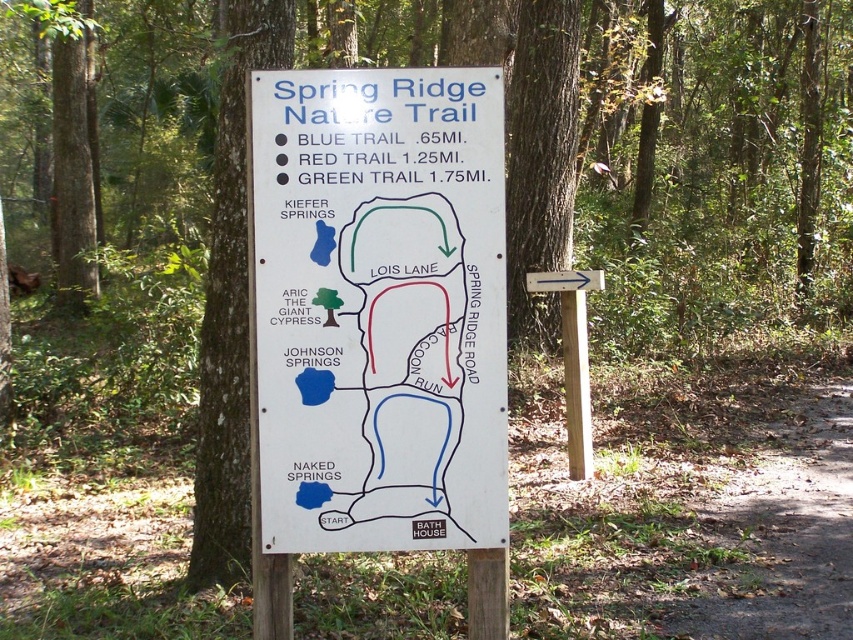
Question: Is dirt path at lower right above brown rough bark tree at left?

Choices:
 (A) yes
 (B) no

Answer: (B)

Question: Which is nearer to the brown rough bark tree at left?

Choices:
 (A) white paper sign at center
 (B) dirt path at lower right

Answer: (A)

Question: Which object is positioned farthest from the white paper sign at center?

Choices:
 (A) brown rough bark tree at left
 (B) dirt path at lower right

Answer: (B)

Question: Which point appears closest to the camera in this image?

Choices:
 (A) (216, 456)
 (B) (778, 465)
 (C) (393, 444)

Answer: (C)

Question: Does dirt path at lower right have a larger size compared to brown rough bark tree at left?

Choices:
 (A) no
 (B) yes

Answer: (B)

Question: Is white paper sign at center below brown rough bark tree at left?

Choices:
 (A) no
 (B) yes

Answer: (B)